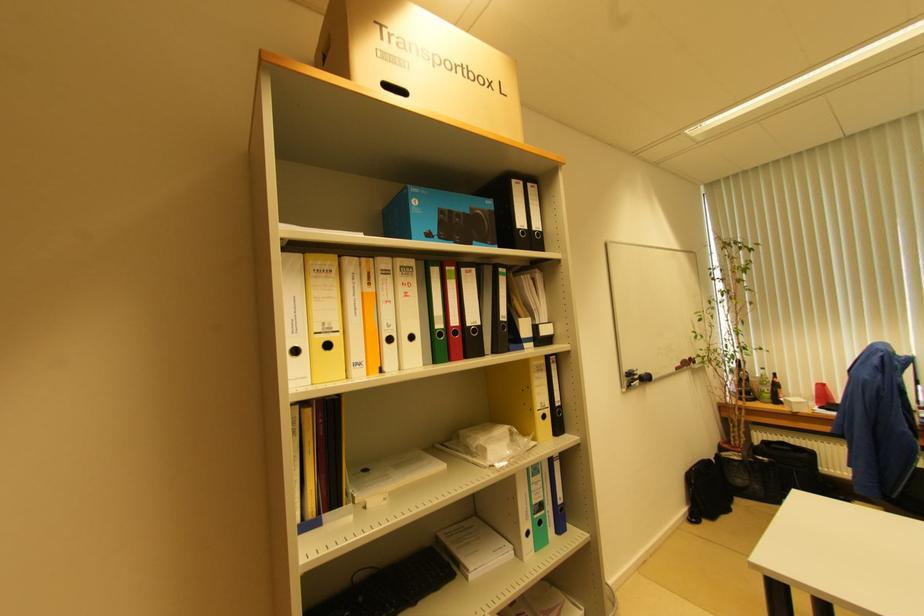
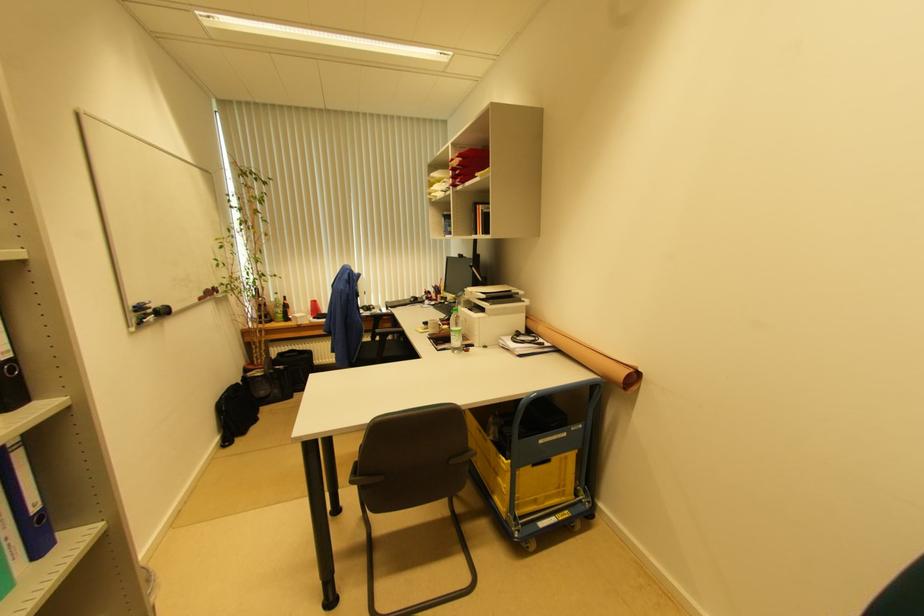
Where in the second image is the point corresponding to point 715,461 from the first image?

(242, 383)